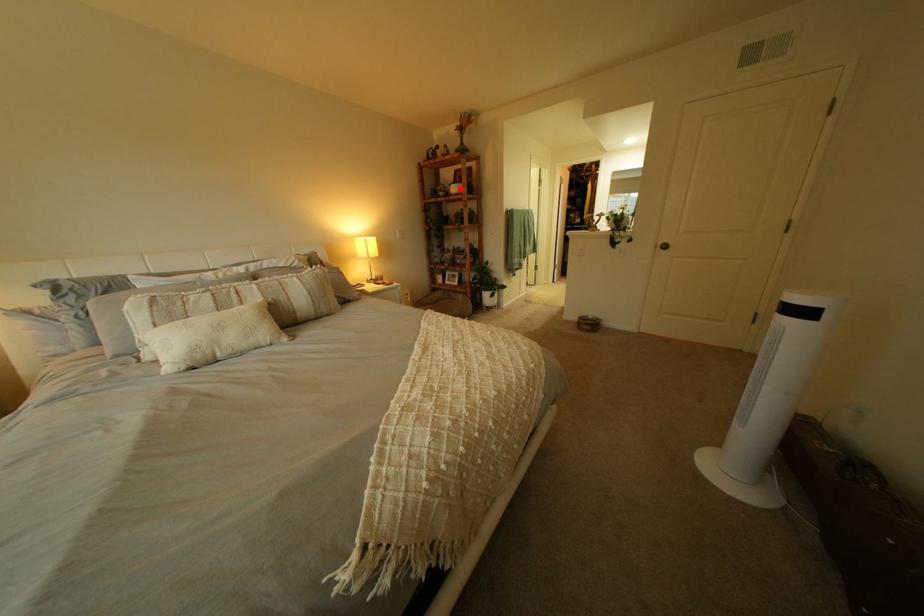
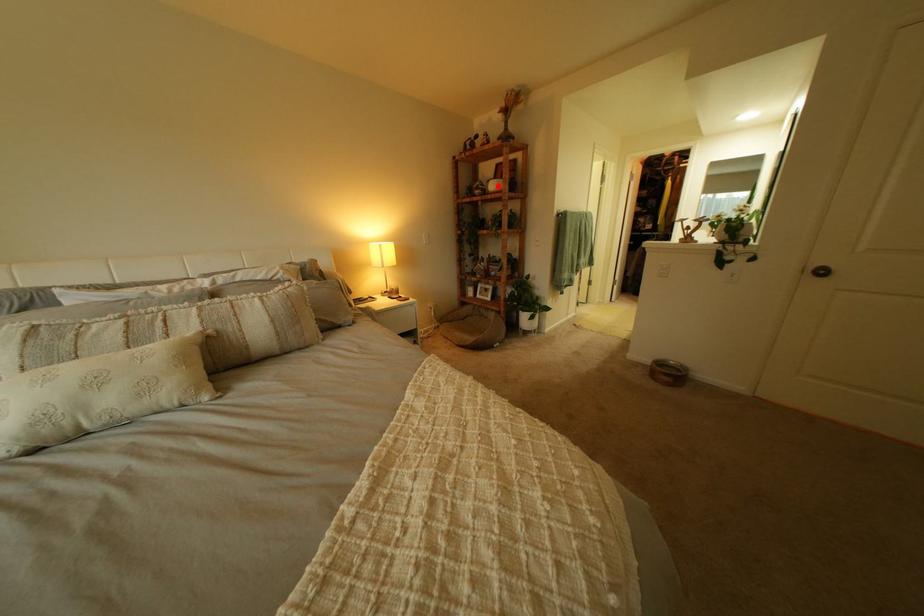
I am providing you with two images of the same scene from different viewpoints. A red point is marked on the first image and another point is marked on the second image. Do the highlighted points in image1 and image2 indicate the same real-world spot?

Yes